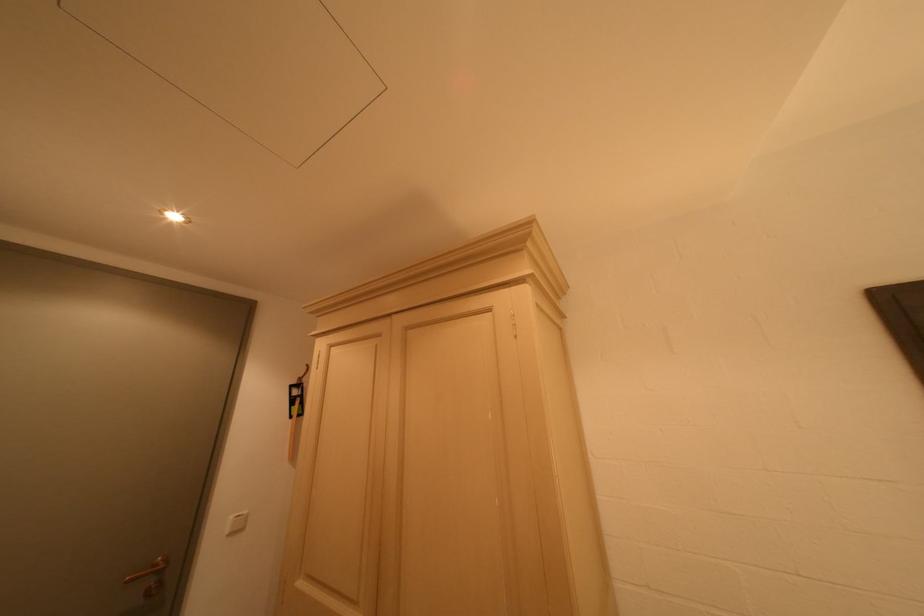
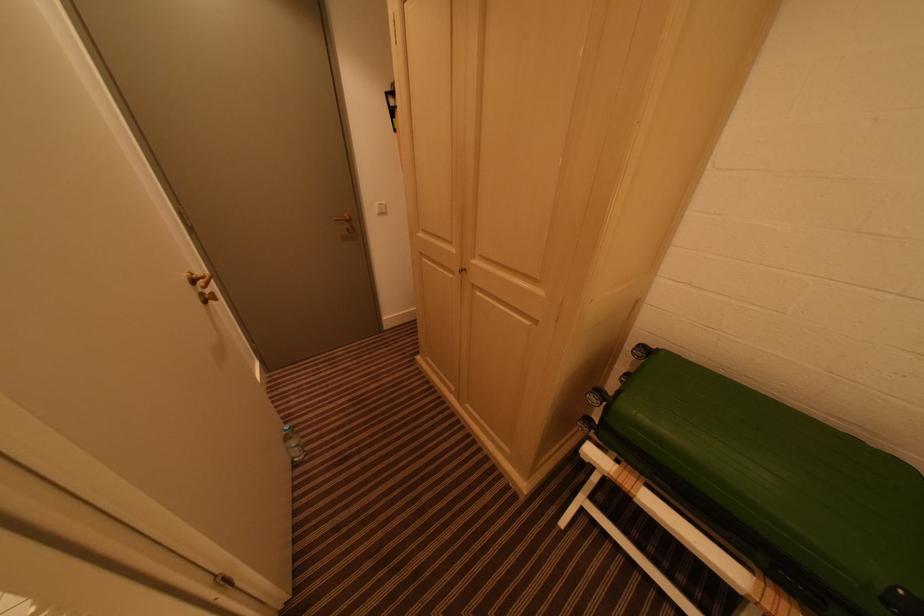
Locate, in the second image, the point that corresponds to (234,533) in the first image.

(383, 214)